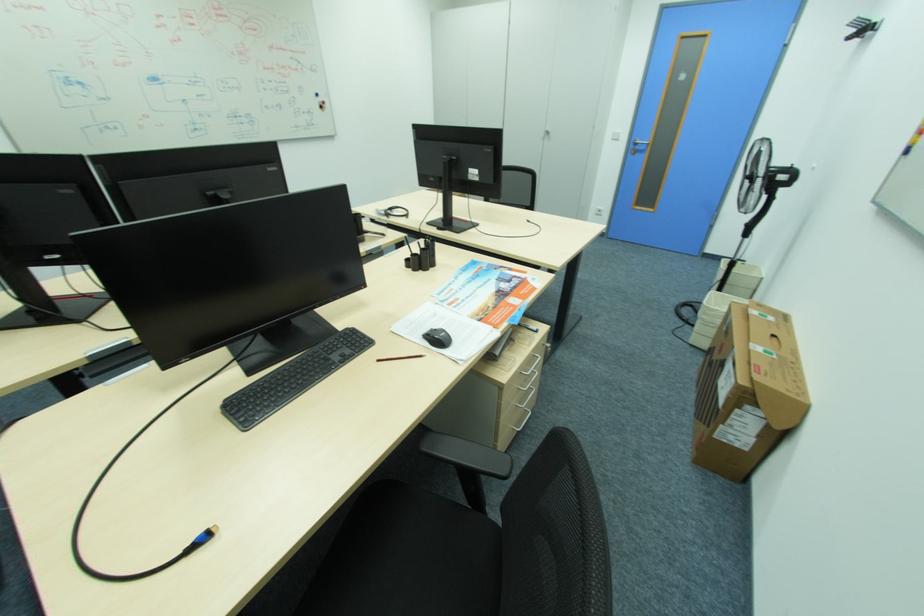
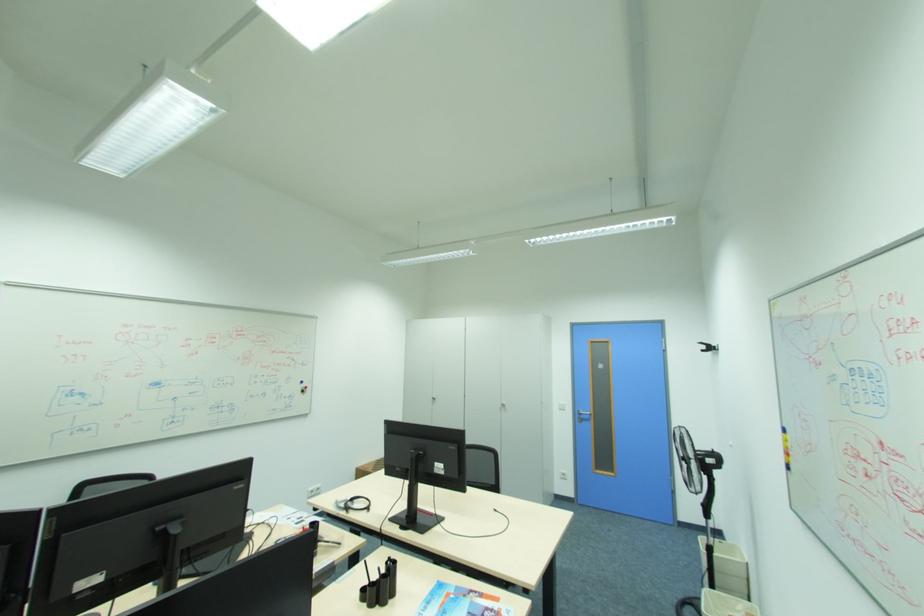
Find the pixel in the second image that matches (x=394, y=213) in the first image.

(355, 505)